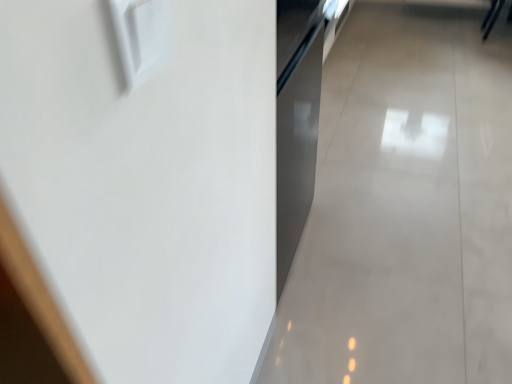
The height and width of the screenshot is (384, 512). In order to click on free point above white glossy wall at upper left (from a real-world perspective) in this screenshot , I will do `click(407, 124)`.